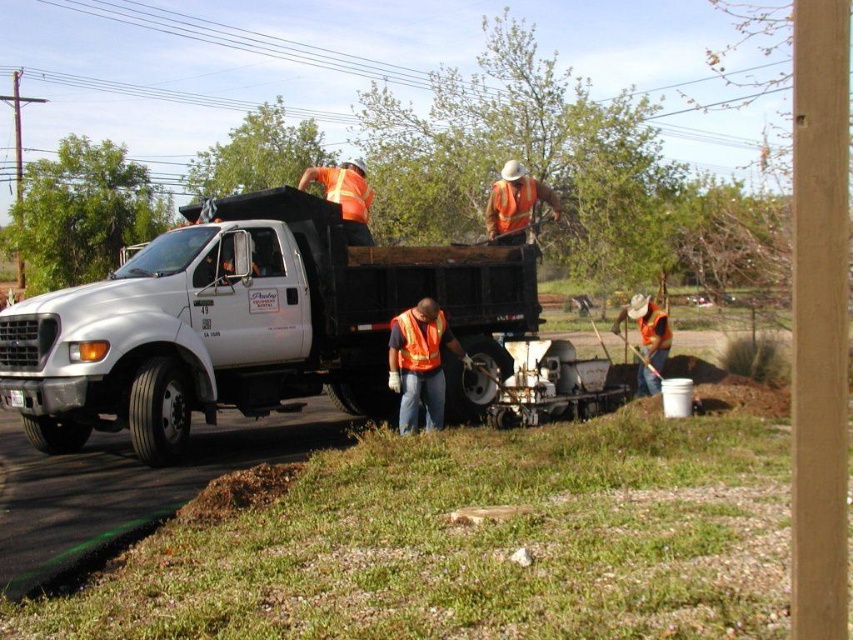
You are a pedestrian trying to cross the road safely. You see a white matte truck at center and a reflective orange vest at center. Which object is closer to you?

The white matte truck at center is closer to you since it is positioned in front of the reflective orange vest at center.

You are a delivery driver who needs to safely navigate through this construction zone. There is a reflective orange vest at center marked by point (421, 364). What should you do to avoid hitting the worker wearing this vest?

The reflective orange vest at center is represented by point (421, 364). To avoid hitting the worker, you should slow down and carefully steer around the worker positioned at that coordinate.

You are a pedestrian crossing the road and see the white matte truck at center and the orange reflective safety vest at center. Which object is closer to the ground?

The white matte truck at center is below orange reflective safety vest at center, so the white matte truck at center is closer to the ground.